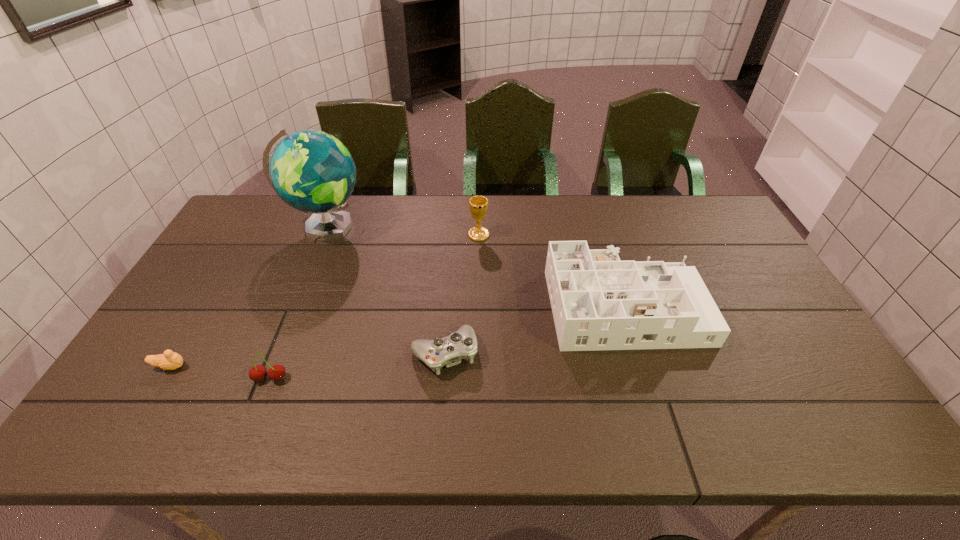
Find the location of a particular element. This screenshot has width=960, height=540. vacant point located 0.080m on the left of the control is located at coordinates (380, 353).

Where is `free space located on the face of the duckling`? The height and width of the screenshot is (540, 960). free space located on the face of the duckling is located at coordinates pyautogui.click(x=339, y=366).

The image size is (960, 540). I want to click on globe located at the far edge, so point(312,171).

Image resolution: width=960 pixels, height=540 pixels. In order to click on chalice at the far edge in this screenshot , I will do `click(478, 205)`.

In order to click on object positioned at the left edge in this screenshot , I will do (169, 360).

The width and height of the screenshot is (960, 540). I want to click on free region at the far edge of the desktop, so [394, 198].

The height and width of the screenshot is (540, 960). In the image, there is a desktop. Identify the location of vacant space at the near edge. (767, 437).

Where is `free region at the left edge of the desktop`? The width and height of the screenshot is (960, 540). free region at the left edge of the desktop is located at coordinates (256, 262).

I want to click on vacant space at the right edge of the desktop, so click(742, 283).

At what (x,y) coordinates should I click in order to perform the action: click on vacant space at the far left corner of the desktop. Please return your answer as a coordinate pair (x, y). The image size is (960, 540). Looking at the image, I should click on (244, 218).